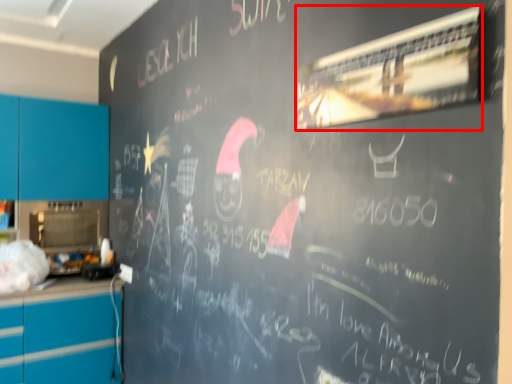
Question: In this image, where is bulletin board (annotated by the red box) located relative to cabinetry?

Choices:
 (A) left
 (B) right

Answer: (B)